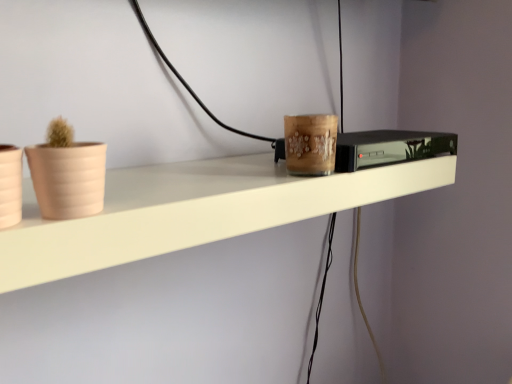
Question: Considering their positions, is beige matte flowerpot at left, which ranks as the second flowerpot in left-to-right order, located in front of or behind black glossy tv at center?

Choices:
 (A) behind
 (B) front

Answer: (B)

Question: From the image's perspective, relative to black glossy tv at center, is beige matte flowerpot at left, the first flowerpot when ordered from right to left, above or below?

Choices:
 (A) above
 (B) below

Answer: (B)

Question: Considering the real-world distances, which object is farthest from the beige matte flowerpot at left, the first flowerpot when ordered from right to left?

Choices:
 (A) black glossy tv at center
 (B) matte beige flowerpot at left, which is the 2th flowerpot in right-to-left order
 (C) white matte shelf at center

Answer: (A)

Question: Considering the real-world distances, which object is closest to the beige matte flowerpot at left, the first flowerpot when ordered from right to left?

Choices:
 (A) matte beige flowerpot at left, positioned as the 1th flowerpot in left-to-right order
 (B) black glossy tv at center
 (C) white matte shelf at center

Answer: (A)